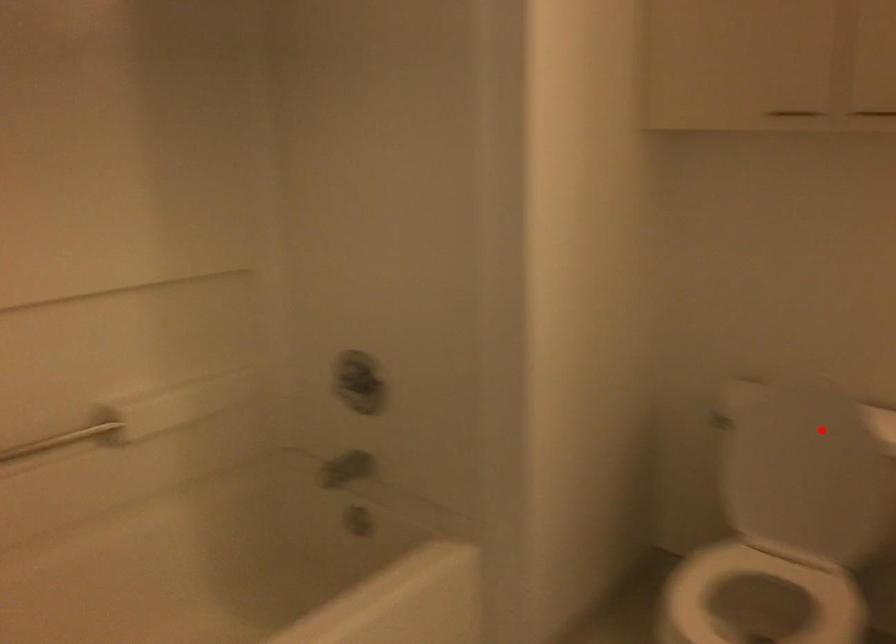
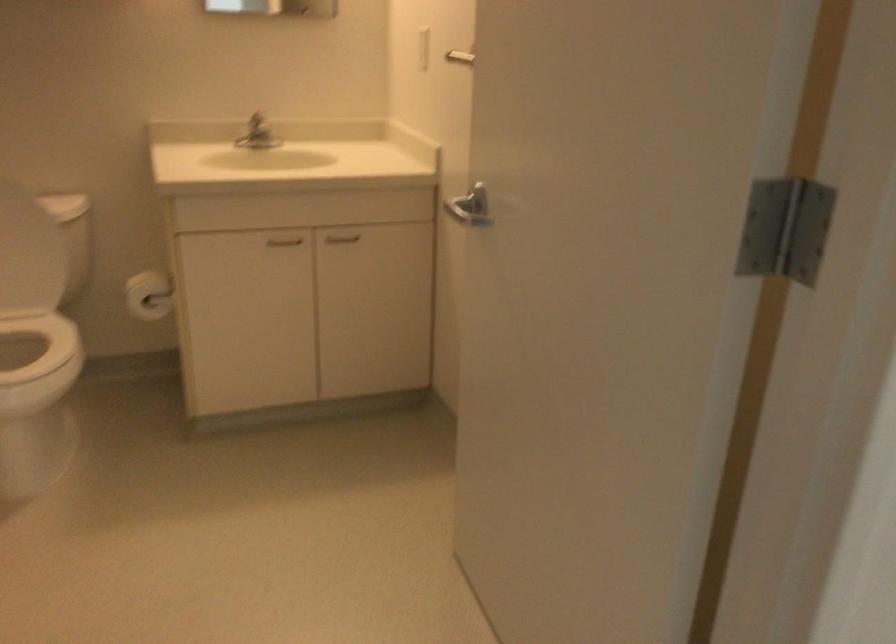
Question: I am providing you with two images of the same scene from different viewpoints. Given a red point in image1, look at the same physical point in image2. Is it:

Choices:
 (A) Closer to the viewpoint
 (B) Farther from the viewpoint

Answer: (B)